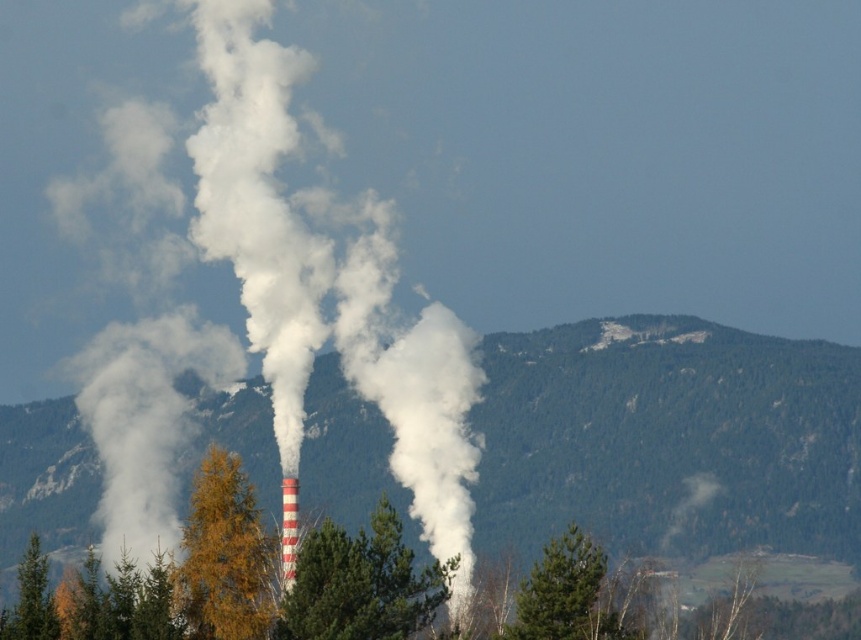
Question: Estimate the real-world distances between objects in this image. Which object is closer to the green textured tree at center?

Choices:
 (A) white smoke at center
 (B) yellow leafy tree at center
 (C) green matte tree at center

Answer: (B)

Question: Based on their relative distances, which object is farther from the green textured tree at center?

Choices:
 (A) green matte tree at lower left
 (B) yellow leafy tree at center
 (C) green matte tree at center

Answer: (A)

Question: Can you confirm if green textured tree at center is positioned to the left of yellow leafy tree at center?

Choices:
 (A) no
 (B) yes

Answer: (A)

Question: Is white smoke at center behind green matte tree at lower left?

Choices:
 (A) no
 (B) yes

Answer: (B)

Question: Considering the real-world distances, which object is farthest from the green textured tree at center?

Choices:
 (A) green matte tree at lower left
 (B) green matte tree at center
 (C) green forested mountain at center

Answer: (C)

Question: Does white smoke at center have a greater width compared to green matte tree at center?

Choices:
 (A) no
 (B) yes

Answer: (B)